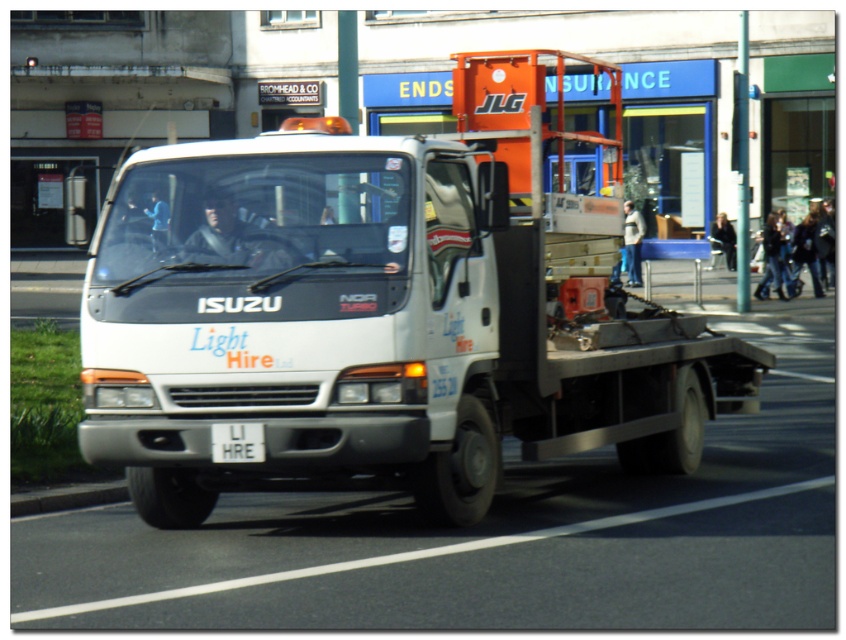
You are standing at a crosswalk and see the white metallic truck at center parked on the street. If you want to take a photo of the truck from where you are standing, will the truck fit entirely within the frame of a standard smartphone camera with a 78.6 degree horizontal field of view? Please explain your reasoning.

The white metallic truck at center is 11.34 meters away from the camera. Using the formula for field of view, the maximum width that can be captured at this distance is calculated by 2 x distance x tan horizontal field of view divided by 2. Plugging in the numbers, it would be 2 x 11.34 x tan 39.3 degrees. The result is approximately 17.8 meters. Since the truck is narrower than 17.8 meters, it will fit within the frame.

Based on the photo, you are a delivery driver who needs to park your car in a spot that requires the license plate to be visible. You see the white metallic truck at center and the white plastic license plate at center in the image. Which object should you position your car so that the license plate is visible to the parking enforcement officer?

You should position your car so the white plastic license plate at center is visible. The white metallic truck at center is to the right of the license plate, so parking in a way that doesn not block the license plate by the truck would ensure visibility.

You are a delivery person trying to read the license plate of the white metallic truck at center. However, you notice something obstructing your view. What is blocking your view of the white plastic license plate at center?

The white metallic truck at center is positioned over the white plastic license plate at center, so the truck itself is blocking the view of the license plate.